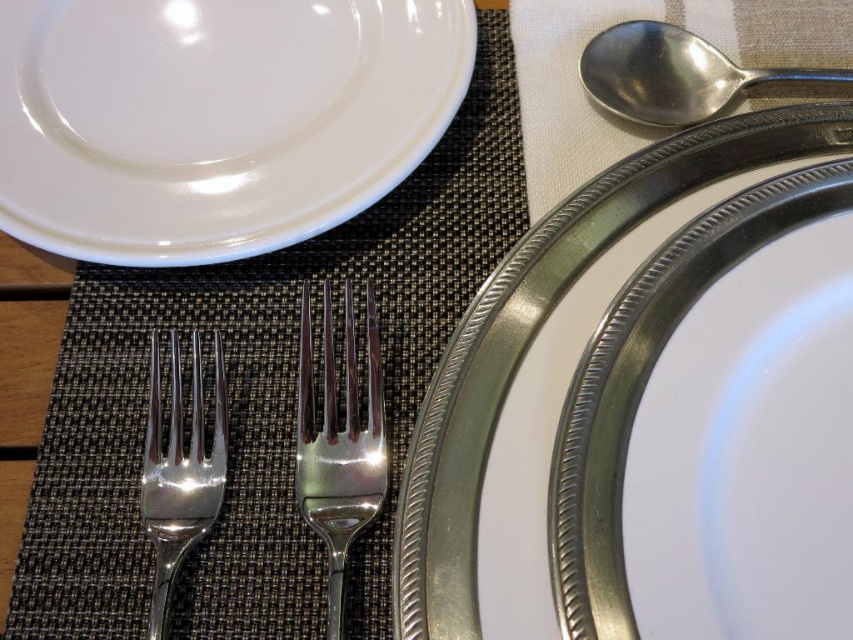
Which is more to the left, metallic silver plate at center or polished silver fork at center-left?

polished silver fork at center-left is more to the left.

Is point (514, 340) farther from camera compared to point (148, 467)?

No, (514, 340) is closer to viewer.

I want to click on metallic silver plate at center, so click(535, 333).

What are the coordinates of `metallic silver plate at center` in the screenshot? It's located at (535, 333).

Is polished silver fork at center wider than polished silver fork at center-left?

Indeed, polished silver fork at center has a greater width compared to polished silver fork at center-left.

Does polished silver fork at center appear under polished silver fork at center-left?

No, polished silver fork at center is not below polished silver fork at center-left.

Is point (331, 580) farther from camera compared to point (161, 625)?

Yes.

Where is `polished silver fork at center`? polished silver fork at center is located at coordinates tap(339, 444).

Can you confirm if polished silver fork at center is positioned below silver metallic spoon at upper right?

Yes.

Which is below, polished silver fork at center or silver metallic spoon at upper right?

polished silver fork at center is below.

Is point (370, 420) behind point (825, 80)?

No, it is in front of (825, 80).

At what (x,y) coordinates should I click in order to perform the action: click on polished silver fork at center. Please return your answer as a coordinate pair (x, y). Image resolution: width=853 pixels, height=640 pixels. Looking at the image, I should click on (339, 444).